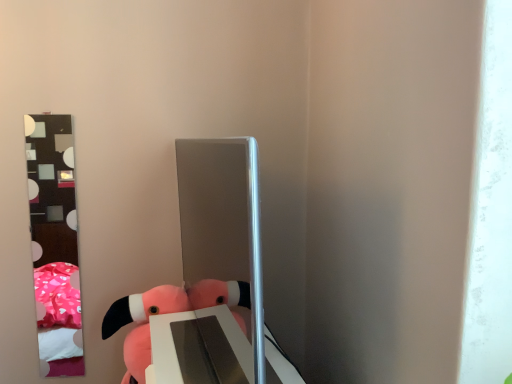
Question: Looking at their shapes, would you say pink plush toy at lower left is wider or thinner than satin silver mirror at center?

Choices:
 (A) wide
 (B) thin

Answer: (A)

Question: Looking at the image, does pink plush toy at lower left seem bigger or smaller compared to satin silver mirror at center?

Choices:
 (A) small
 (B) big

Answer: (A)

Question: Estimate the real-world distances between objects in this image. Which object is farther from the metallic reflective mirror at left?

Choices:
 (A) pink plush toy at lower left
 (B) satin silver mirror at center

Answer: (B)

Question: Considering the real-world distances, which object is closest to the satin silver mirror at center?

Choices:
 (A) pink plush toy at lower left
 (B) metallic reflective mirror at left

Answer: (A)